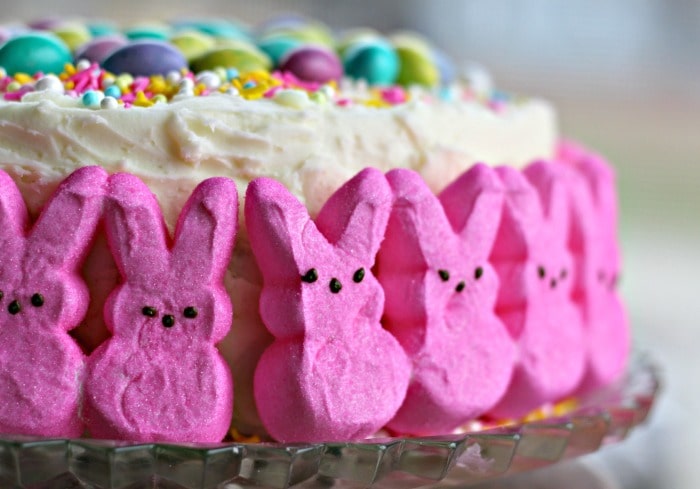
Where is `glass cake plate`? The width and height of the screenshot is (700, 489). glass cake plate is located at coordinates (458, 460).